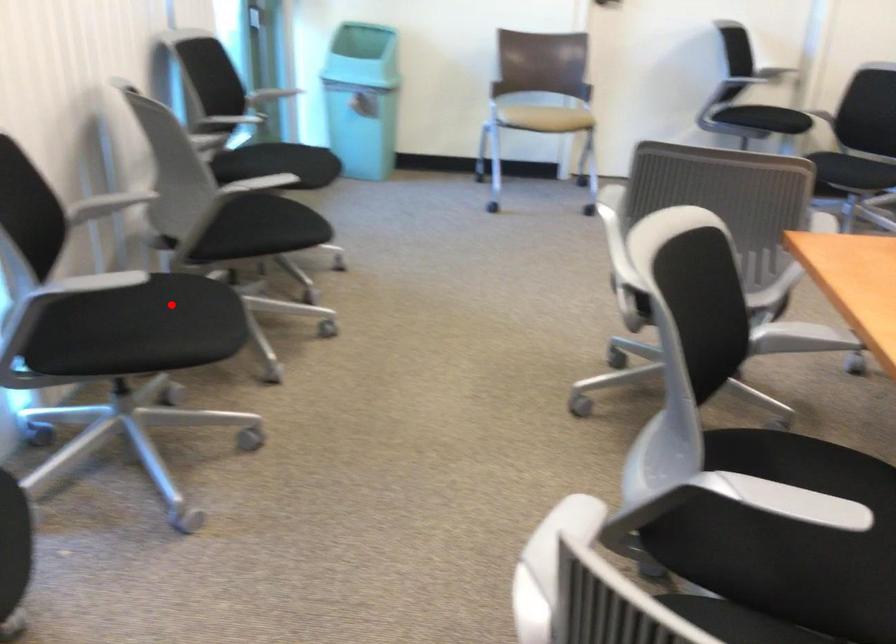
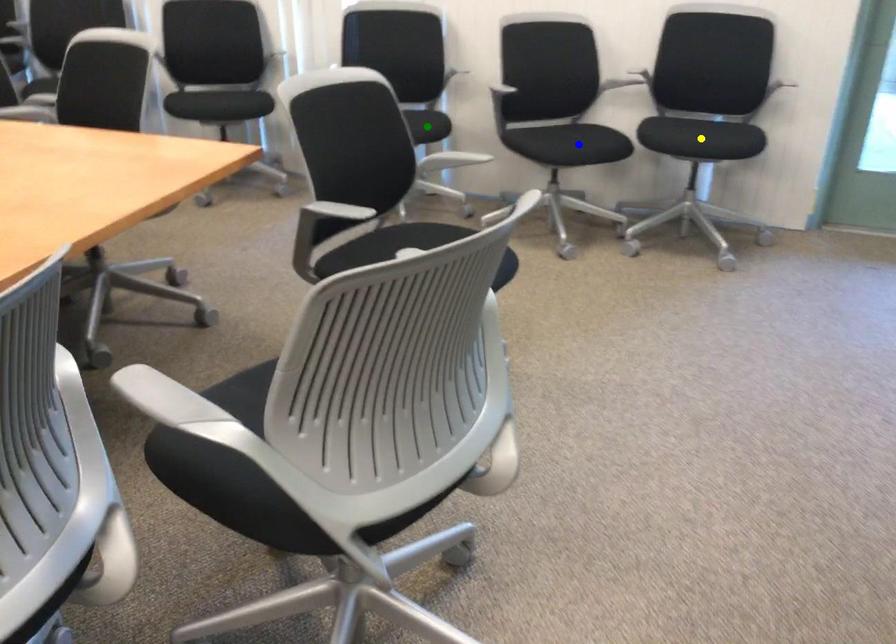
Question: I am providing you with two images of the same scene from different viewpoints. A red point is marked on the first image. You are given multiple points on the second image. In image 2, which mark is for the same physical point as the one in image 1?

Choices:
 (A) green point
 (B) yellow point
 (C) blue point

Answer: (A)